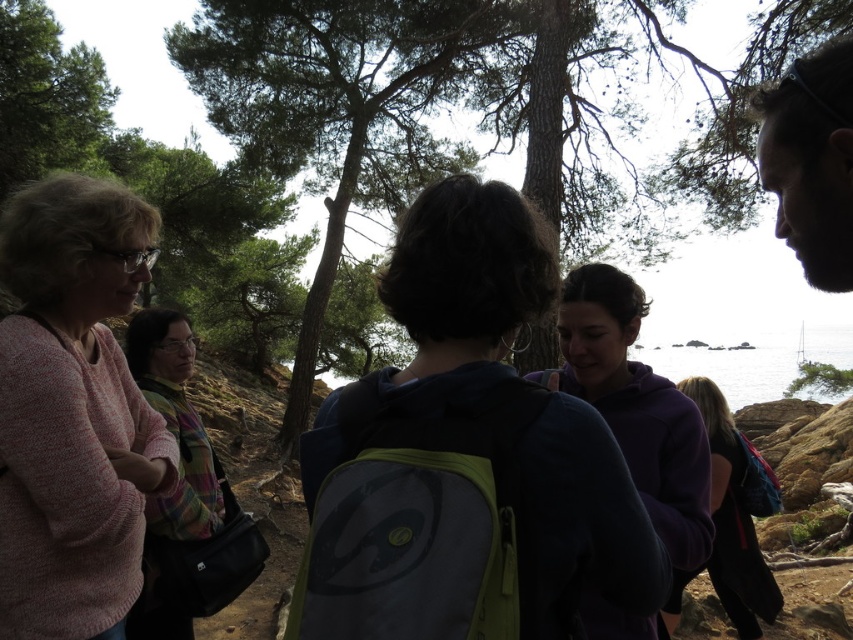
Does pink knitted sweater at left appear over purple fleece jacket at lower right?

Yes, pink knitted sweater at left is above purple fleece jacket at lower right.

What are the coordinates of `pink knitted sweater at left` in the screenshot? It's located at (73, 410).

Who is positioned more to the left, pink knitted sweater at left or green textured tree at center?

pink knitted sweater at left is more to the left.

Between pink knitted sweater at left and green textured tree at center, which one has less height?

green textured tree at center is shorter.

Where is `pink knitted sweater at left`? pink knitted sweater at left is located at coordinates pyautogui.click(x=73, y=410).

Is pink knitted sweater at left positioned at the back of multicolored knitted sweater at left?

That is False.

The width and height of the screenshot is (853, 640). Identify the location of pink knitted sweater at left. (73, 410).

Where is `pink knitted sweater at left`? pink knitted sweater at left is located at coordinates (73, 410).